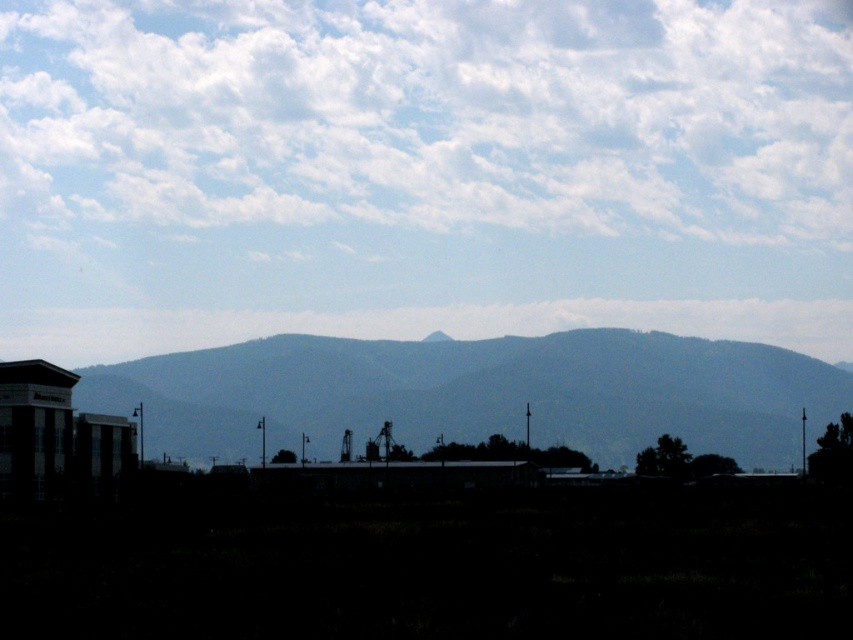
Question: Considering the relative positions of white fluffy cloud at upper center and gray textured mountain range at center in the image provided, where is white fluffy cloud at upper center located with respect to gray textured mountain range at center?

Choices:
 (A) below
 (B) above

Answer: (B)

Question: Among these objects, which one is farthest from the camera?

Choices:
 (A) gray textured mountain range at center
 (B) white fluffy cloud at upper center

Answer: (B)

Question: Does white fluffy cloud at upper center have a smaller size compared to gray textured mountain range at center?

Choices:
 (A) yes
 (B) no

Answer: (A)

Question: Which point is closer to the camera?

Choices:
 (A) (776, 120)
 (B) (737, 355)

Answer: (B)

Question: Can you confirm if white fluffy cloud at upper center is positioned to the right of gray textured mountain range at center?

Choices:
 (A) no
 (B) yes

Answer: (A)

Question: Which of the following is the closest to the observer?

Choices:
 (A) (154, 97)
 (B) (846, 404)

Answer: (B)